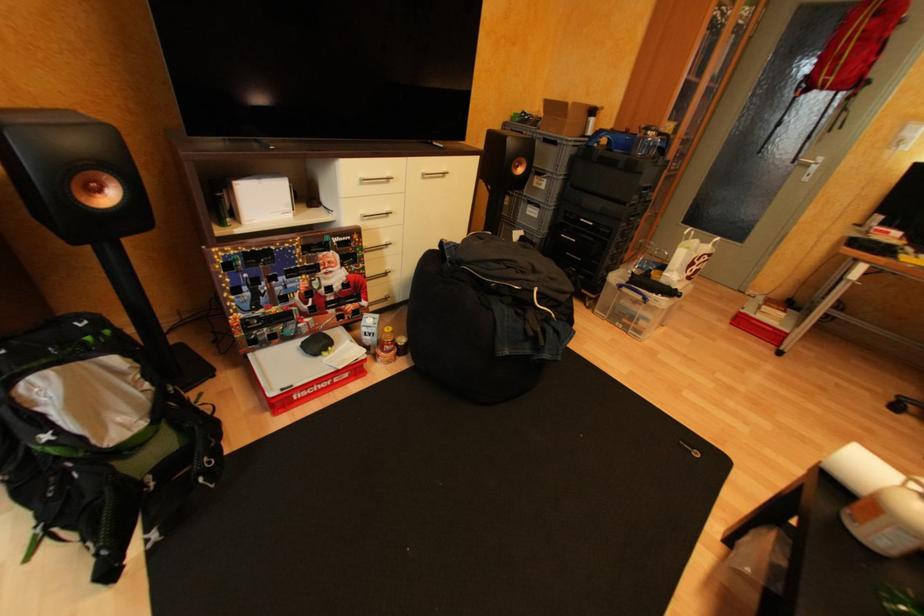
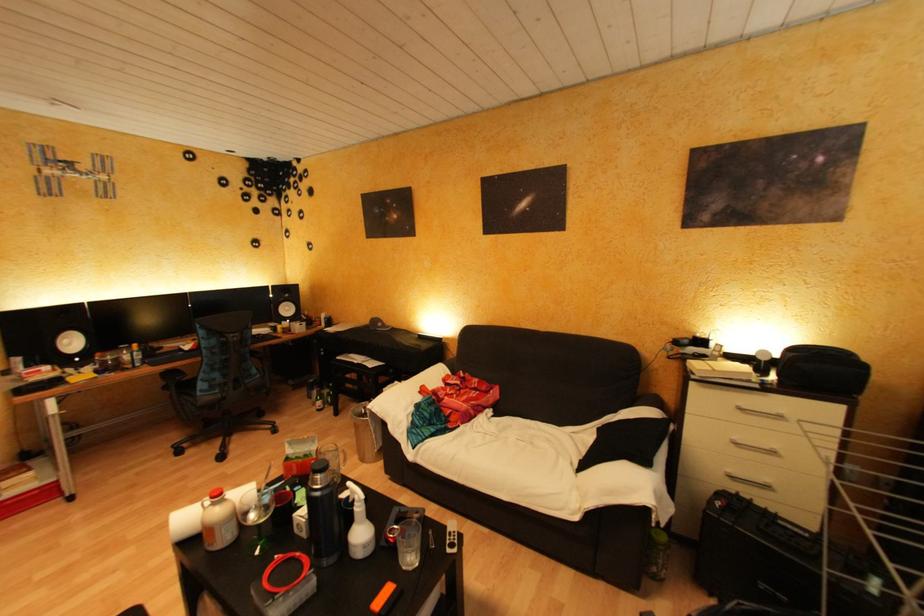
The images are taken continuously from a first-person perspective. In which direction is your viewpoint rotating?

The camera rotated toward right-down.